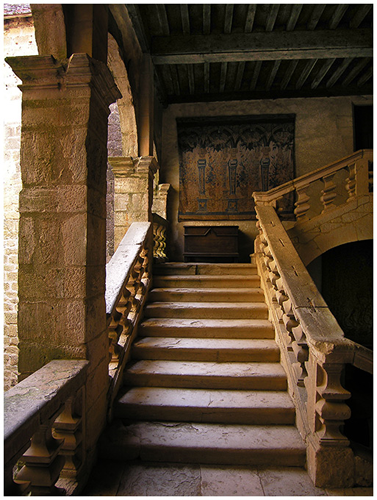
Locate an element on the screen. Image resolution: width=377 pixels, height=500 pixels. tapestry is located at coordinates (241, 165).